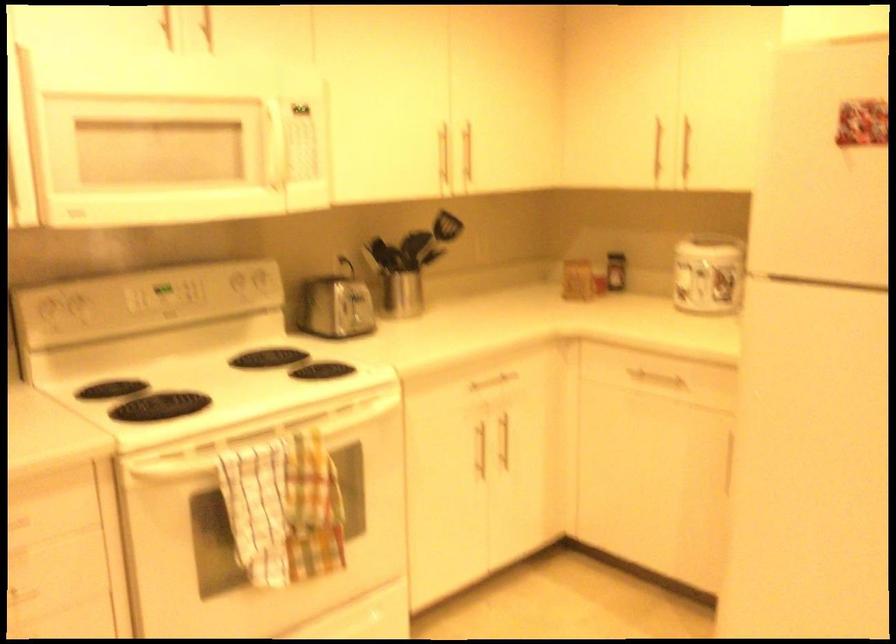
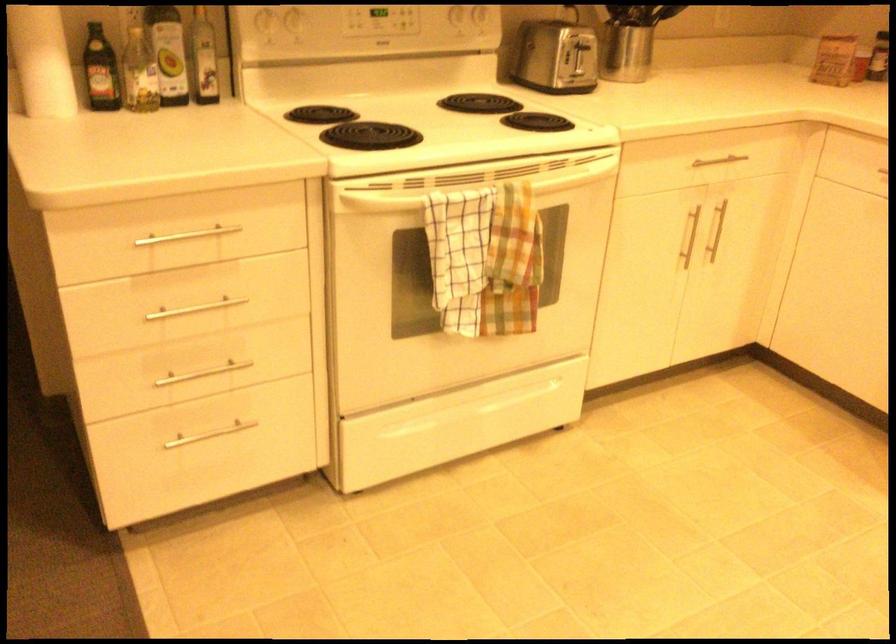
Where in the second image is the point corresponding to [484,450] from the first image?

(687, 237)